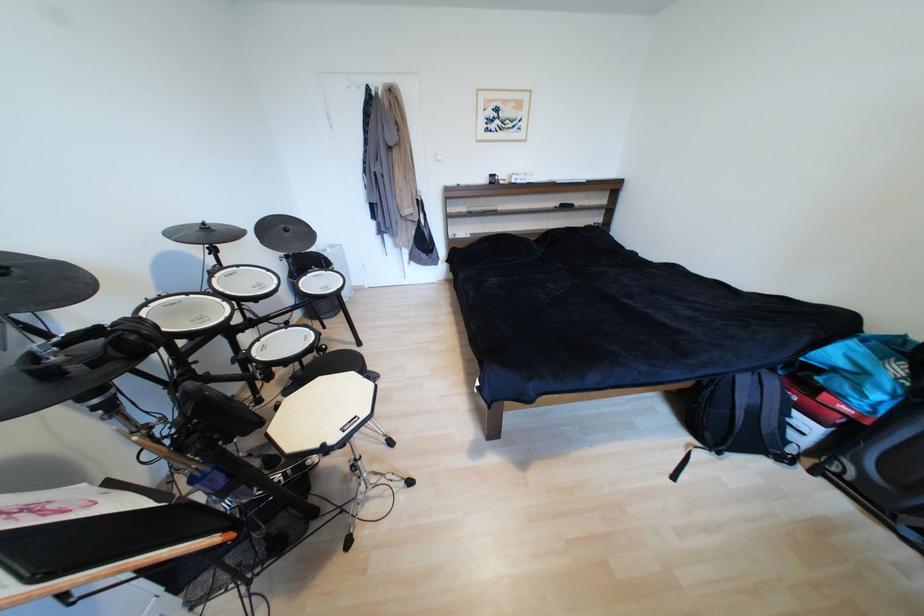
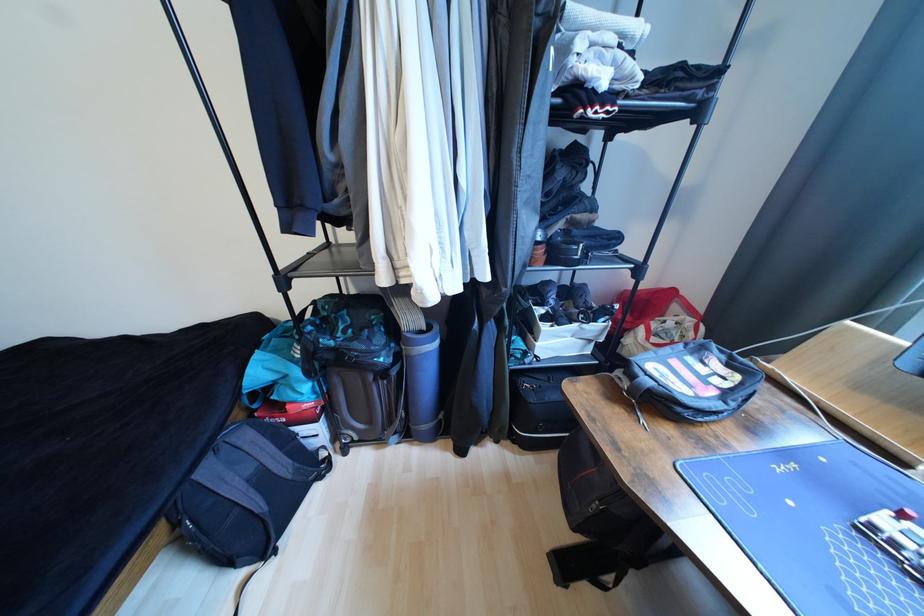
In the second image, find the point that corresponds to (x=751, y=381) in the first image.

(215, 472)